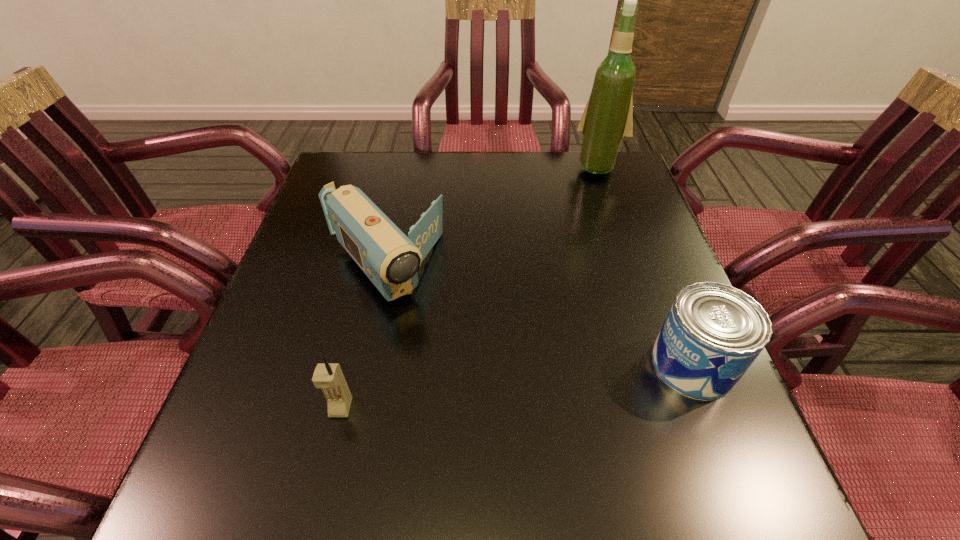
At what (x,y) coordinates should I click in order to perform the action: click on free spot on the desktop that is between the cellular telephone and the shortest object and is positioned on the front-facing side of the tallest object. Please return your answer as a coordinate pair (x, y). The image size is (960, 540). Looking at the image, I should click on (497, 389).

Find the location of a particular element. free space on the desktop that is between the cellular telephone and the shortest object and is positioned on the side of the camcorder with the flip-out screen is located at coordinates (486, 390).